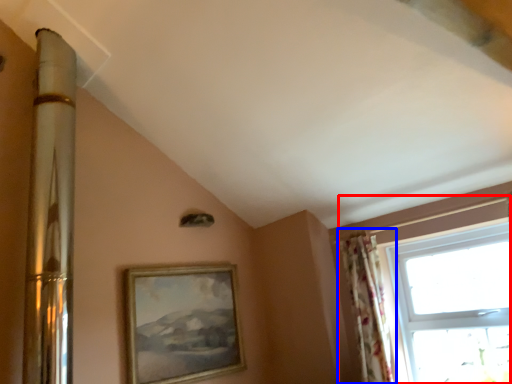
Question: Which object is further to the camera taking this photo, window (highlighted by a red box) or curtain (highlighted by a blue box)?

Choices:
 (A) window
 (B) curtain

Answer: (B)